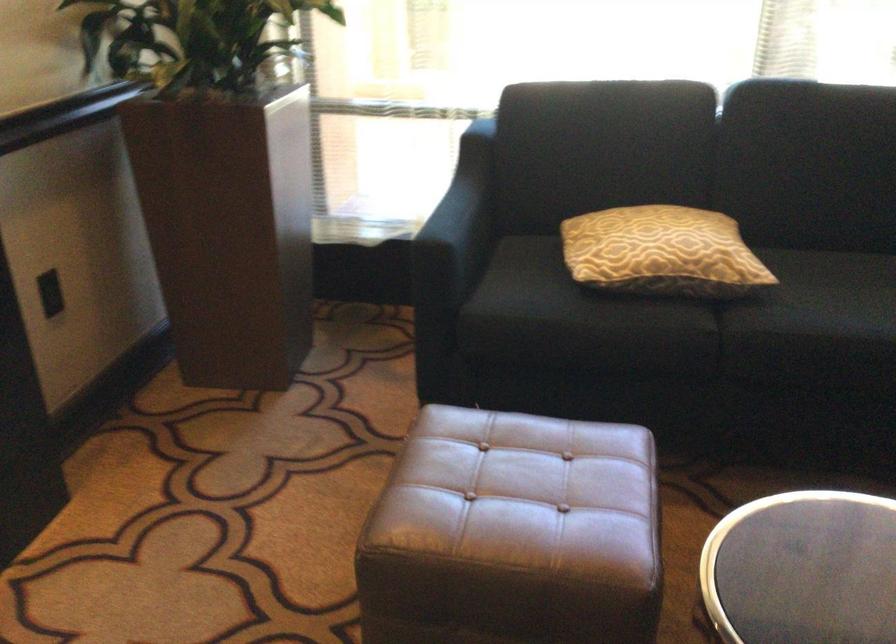
At what (x,y) coordinates should I click in order to perform the action: click on brown leather ottoman. Please return your answer as a coordinate pair (x, y). The width and height of the screenshot is (896, 644). Looking at the image, I should click on (522, 495).